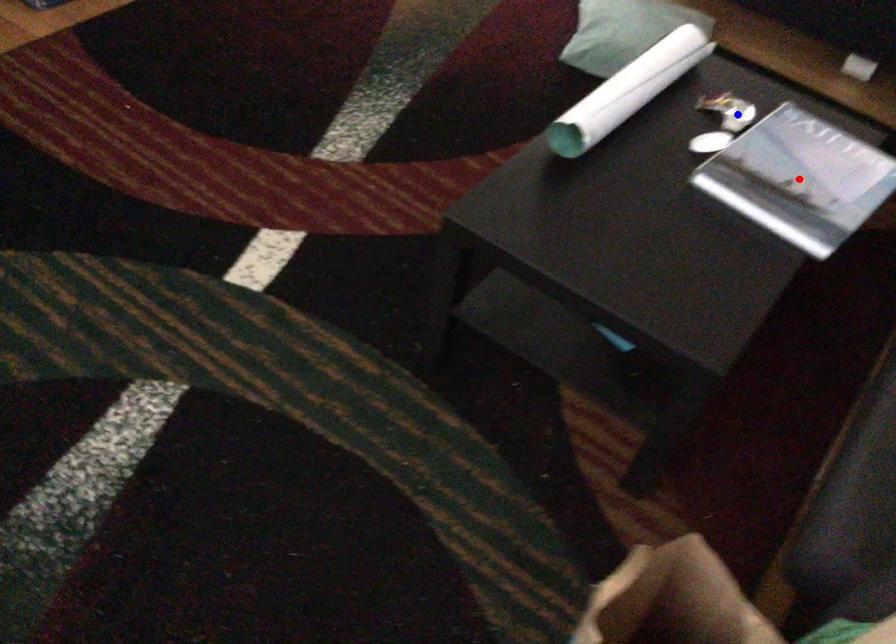
Question: In the image, two points are highlighted. Which point is nearer to the camera? Reply with the corresponding letter.

Choices:
 (A) blue point
 (B) red point

Answer: (B)